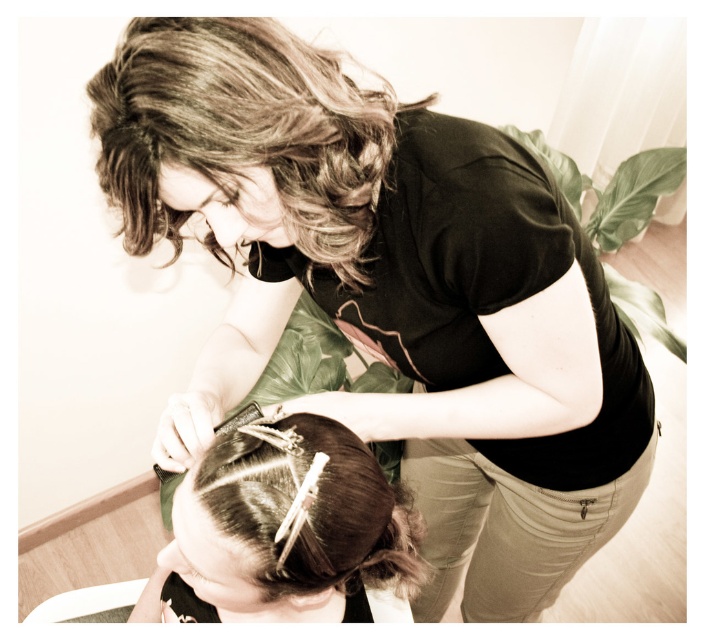
Question: Which of the following is the farthest from the observer?

Choices:
 (A) (403, 584)
 (B) (135, 40)

Answer: (A)

Question: Estimate the real-world distances between objects in this image. Which object is farther from the curly brown hair at upper center?

Choices:
 (A) dark brown silky hair at lower center
 (B) silver metallic hair clip at center

Answer: (A)

Question: Considering the relative positions of curly brown hair at upper center and silver metallic hair clip at center in the image provided, where is curly brown hair at upper center located with respect to silver metallic hair clip at center?

Choices:
 (A) above
 (B) below

Answer: (A)

Question: Can you confirm if curly brown hair at upper center is bigger than dark brown silky hair at lower center?

Choices:
 (A) yes
 (B) no

Answer: (A)

Question: Which object is closer to the camera taking this photo?

Choices:
 (A) curly brown hair at upper center
 (B) silver metallic hair clip at center
 (C) dark brown silky hair at lower center

Answer: (A)

Question: Is silver metallic hair clip at center wider than dark brown silky hair at lower center?

Choices:
 (A) no
 (B) yes

Answer: (B)